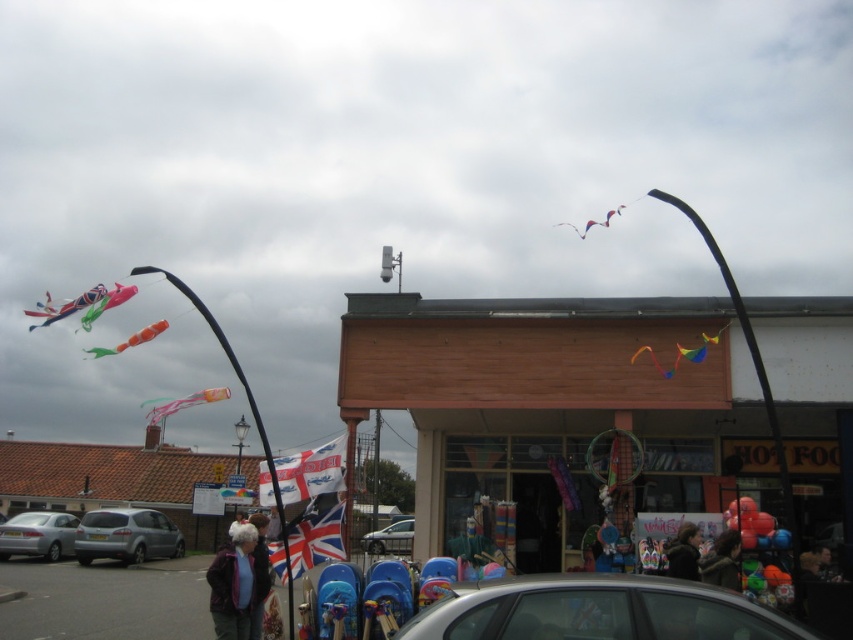
You are a photographer trying to capture the rainbow fabric kite at center without including the purple fleece jacket at lower left in the frame. Given their sizes, is this possible?

The purple fleece jacket at lower left occupies less space than rainbow fabric kite at center, so it is possible to frame the rainbow fabric kite at center without including the purple fleece jacket at lower left by focusing on the larger kite and adjusting the camera angle to exclude the smaller jacket.

You are a customer standing at the entrance of the shop and want to buy the matte plastic kite at upper left. You notice a purple fleece jacket at lower left nearby. Which item is physically closer to you?

The purple fleece jacket at lower left is closer to you since it is positioned at lower left compared to the matte plastic kite at upper left, which is located further away at upper left.

Looking at this image, you are standing in front of the shop and want to take a photo of both the point at coordinates point (647, 579) and the point at coordinates point (612, 208). Which point will appear larger in your photo?

Point (647, 579) is closer to the camera than point (612, 208), so it will appear larger in the photo.